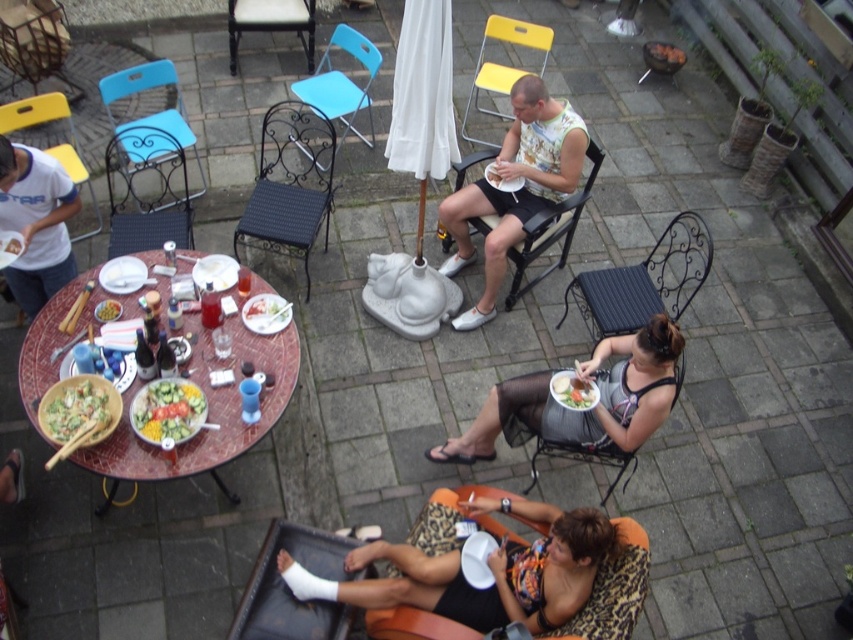
You are a photographer trying to capture a candid shot of the floral tank top at center and the blue plastic chair at upper left. To ensure both are in frame, you need to know their relative positions. Which object is located to the right of the other?

The floral tank top at center is positioned on the right side of the blue plastic chair at upper left.

You are a guest at this outdoor dining event and want to grab a salad from the table. Which object is located to the right of the green matte bowl at center where you can find the fresh salad at center?

The fresh salad at center is located to the right of the green matte bowl at center, so you can find it there.

You are planning to take a photo of the floral tank top at center and the blue plastic chair at upper left. Which object should you focus on first if you want to capture both in the same frame without moving the camera?

The floral tank top at center is smaller than the blue plastic chair at upper left, so you should focus on the blue plastic chair at upper left first to ensure it fits properly in the frame.